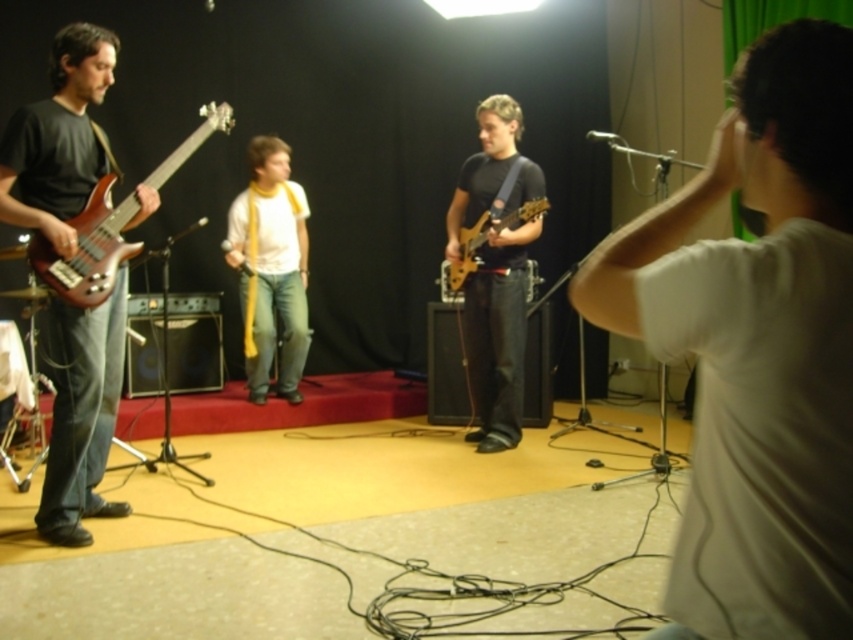
You are a stagehand who needs to move the matte black guitar at center to the left side of the stage. The stage is 16 feet wide. Can you safely move the guitar to the left side without it going off the stage?

The distance between them is 14.30 feet, so yes, the matte black guitar at center can be moved to the left side of the stage since the stage is 16 feet wide, which is wider than the distance required.